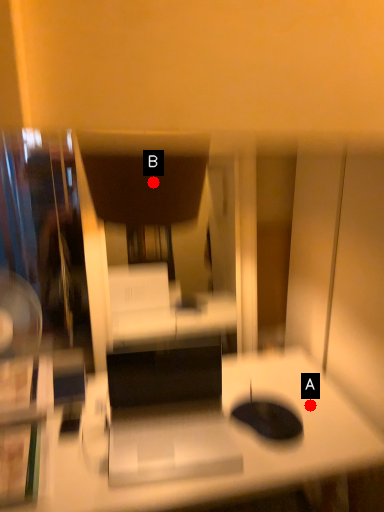
Question: Two points are circled on the image, labeled by A and B beside each circle. Which point appears closest to the camera in this image?

Choices:
 (A) A is closer
 (B) B is closer

Answer: (B)